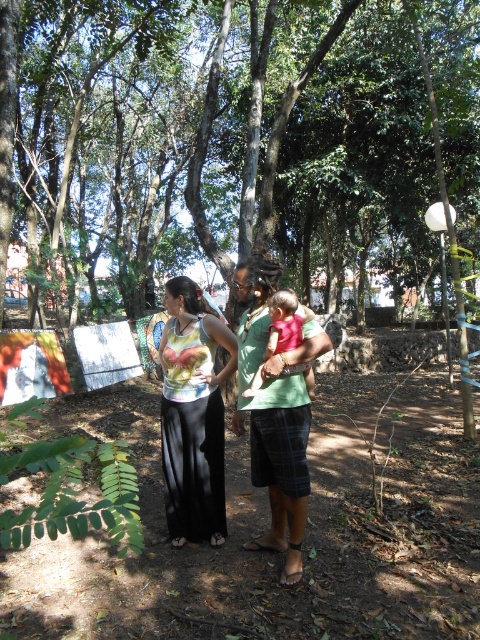
You are planning to take a photo of the two clothing items, green plaid shorts at center and printed fabric top at center. Which clothing item should you focus on to ensure it appears larger in the photo?

The green plaid shorts at center is bigger than the printed fabric top at center, so you should focus on the green plaid shorts at center to ensure it appears larger in the photo.

You are a photographer trying to capture a candid shot of the scene. You notice the green plaid shorts at center and the pink fabric baby at center. Which object is positioned closer to you, the photographer, in this composition?

The green plaid shorts at center is closer to the viewer than the pink fabric baby at center, so the photographer would see the green plaid shorts at center first in terms of depth.

You are a photographer trying to capture a candid shot of the printed fabric top at center and the pink fabric baby at center. Since you want to ensure both subjects are in focus, you need to know their relative positions. Which object is located to the left of the other?

The printed fabric top at center is positioned on the left side of pink fabric baby at center, so it is the one located to the left.